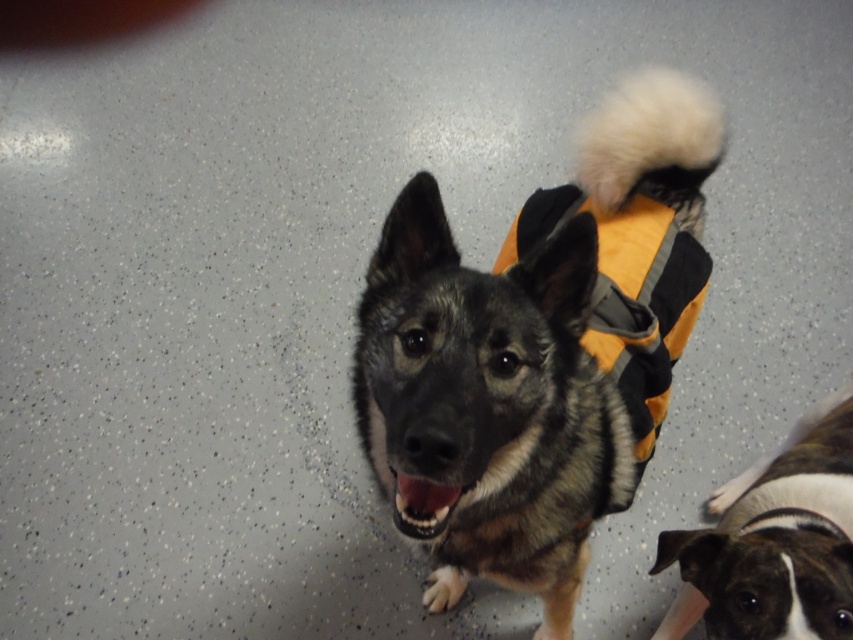
This screenshot has height=640, width=853. What do you see at coordinates (532, 353) in the screenshot? I see `orange fabric vest at center` at bounding box center [532, 353].

Does orange fabric vest at center appear under brown and white fur at lower right?

Incorrect, orange fabric vest at center is not positioned below brown and white fur at lower right.

Image resolution: width=853 pixels, height=640 pixels. What do you see at coordinates (532, 353) in the screenshot?
I see `orange fabric vest at center` at bounding box center [532, 353].

At what (x,y) coordinates should I click in order to perform the action: click on orange fabric vest at center. Please return your answer as a coordinate pair (x, y). Image resolution: width=853 pixels, height=640 pixels. Looking at the image, I should click on (532, 353).